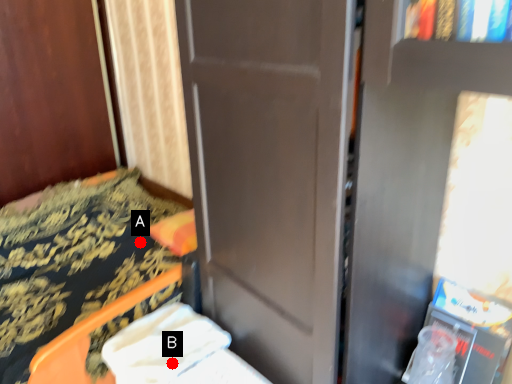
Question: Two points are circled on the image, labeled by A and B beside each circle. Which point is closer to the camera?

Choices:
 (A) A is closer
 (B) B is closer

Answer: (B)